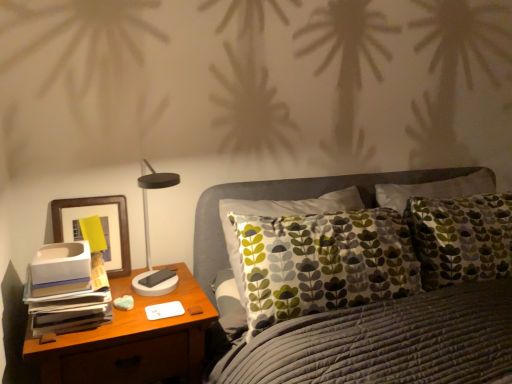
This screenshot has height=384, width=512. I want to click on wooden nightstand at left, so 131,342.

Describe the element at coordinates (90, 215) in the screenshot. I see `wooden picture frame at left` at that location.

Find the location of a particular element. The image size is (512, 384). matte black table lamp at left is located at coordinates click(149, 239).

The width and height of the screenshot is (512, 384). Identify the location of wooden nightstand at left. (131, 342).

Between wooden picture frame at left and wooden nightstand at left, which one has less height?

With less height is wooden picture frame at left.

Considering the relative sizes of wooden picture frame at left and wooden nightstand at left in the image provided, is wooden picture frame at left thinner than wooden nightstand at left?

Yes.

Which is closer to the camera, (73, 208) or (42, 368)?

Point (73, 208) is positioned farther from the camera compared to point (42, 368).

Could you tell me if wooden picture frame at left is facing wooden nightstand at left?

No.

Is wooden picture frame at left further to camera compared to matte black table lamp at left?

Yes, wooden picture frame at left is further from the camera.

Does wooden picture frame at left appear on the right side of matte black table lamp at left?

No, wooden picture frame at left is not to the right of matte black table lamp at left.

Locate an element on the screen. The height and width of the screenshot is (384, 512). table lamp lying on the right of wooden picture frame at left is located at coordinates (149, 239).

Does wooden nightstand at left have a lesser height compared to wooden picture frame at left?

Incorrect, the height of wooden nightstand at left does not fall short of that of wooden picture frame at left.

Considering the relative positions of wooden nightstand at left and wooden picture frame at left in the image provided, is wooden nightstand at left in front of wooden picture frame at left?

Yes, wooden nightstand at left is closer to the viewer.

Considering the relative positions of wooden nightstand at left and wooden picture frame at left in the image provided, is wooden nightstand at left to the left or to the right of wooden picture frame at left?

In the image, wooden nightstand at left appears on the right side of wooden picture frame at left.

Is point (156, 336) behind point (69, 199)?

No, (156, 336) is closer to viewer.

From a real-world perspective, which is physically below, wooden nightstand at left or matte black table lamp at left?

wooden nightstand at left, from a real-world perspective.

Is the depth of wooden nightstand at left greater than that of matte black table lamp at left?

That is False.

How much distance is there between wooden nightstand at left and matte black table lamp at left?

wooden nightstand at left is 7.40 inches from matte black table lamp at left.

Is point (124, 351) more distant than point (174, 173)?

No.

Is point (166, 179) farther from viewer compared to point (179, 293)?

No, it is not.

Which is in front, matte black table lamp at left or wooden nightstand at left?

Positioned in front is wooden nightstand at left.

Can you tell me how much matte black table lamp at left and wooden nightstand at left differ in facing direction?

The angular difference between matte black table lamp at left and wooden nightstand at left is 4.03 degrees.

Can you confirm if matte black table lamp at left is shorter than wooden nightstand at left?

Correct, matte black table lamp at left is not as tall as wooden nightstand at left.

Based on the photo, from the image's perspective, which object appears higher, matte black table lamp at left or wooden picture frame at left?

matte black table lamp at left appears higher in the image.

Consider the image. Can wooden picture frame at left be found inside matte black table lamp at left?

No.

Is matte black table lamp at left closer to camera compared to wooden picture frame at left?

Yes, it is in front of wooden picture frame at left.

The height and width of the screenshot is (384, 512). Find the location of `picture frame above the wooden nightstand at left (from a real-world perspective)`. picture frame above the wooden nightstand at left (from a real-world perspective) is located at coordinates (90, 215).

Identify the location of table lamp above the wooden picture frame at left (from the image's perspective). (149, 239).

From the picture: Looking at the image, which one is located further to wooden picture frame at left, matte black table lamp at left or wooden nightstand at left?

The object further to wooden picture frame at left is wooden nightstand at left.

Looking at the image, which one is located closer to wooden nightstand at left, matte black table lamp at left or wooden picture frame at left?

Based on the image, matte black table lamp at left appears to be nearer to wooden nightstand at left.

Looking at the image, which one is located further to wooden nightstand at left, wooden picture frame at left or matte black table lamp at left?

wooden picture frame at left lies further to wooden nightstand at left than the other object.

Which object lies further to the anchor point matte black table lamp at left, wooden nightstand at left or wooden picture frame at left?

wooden nightstand at left lies further to matte black table lamp at left than the other object.

From the image, which object appears to be farther from wooden picture frame at left, wooden nightstand at left or matte black table lamp at left?

wooden nightstand at left.

When comparing their distances from matte black table lamp at left, does wooden picture frame at left or wooden nightstand at left seem closer?

The object closer to matte black table lamp at left is wooden picture frame at left.

What are the coordinates of `picture frame between matte black table lamp at left and wooden nightstand at left vertically` in the screenshot? It's located at (90, 215).